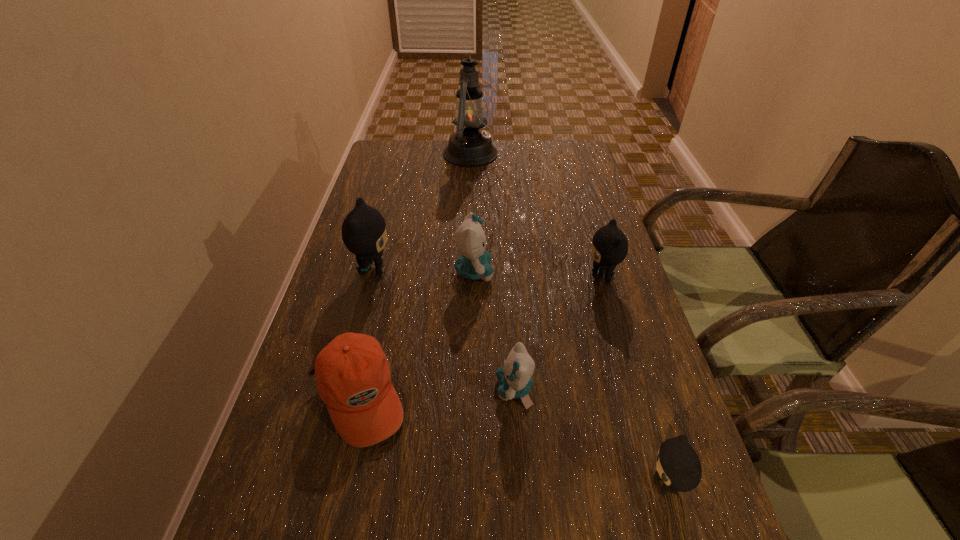
This screenshot has width=960, height=540. Find the location of `vacant area situated 0.100m on the front of the baseball cap`. vacant area situated 0.100m on the front of the baseball cap is located at coordinates point(332,511).

Identify the location of vacant space located 0.380m on the front-facing side of the nearest gray kitten. (417, 485).

Identify the location of vacant space located on the front-facing side of the nearest gray kitten. (459, 485).

The width and height of the screenshot is (960, 540). In order to click on free location located 0.260m on the front-facing side of the nearest gray kitten in this screenshot , I will do `click(490, 485)`.

Find the location of a particular element. object that is at the far edge is located at coordinates (468, 146).

I want to click on kitten at the left edge, so click(364, 232).

I want to click on baseball cap situated at the left edge, so click(353, 376).

At what (x,y) coordinates should I click in order to perform the action: click on vacant space at the left edge of the desktop. Please return your answer as a coordinate pair (x, y). Looking at the image, I should click on (376, 180).

The image size is (960, 540). In order to click on free space at the right edge in this screenshot , I will do `click(568, 185)`.

Find the location of a particular element. vacant space that's between the baseball cap and the farthest object is located at coordinates (417, 275).